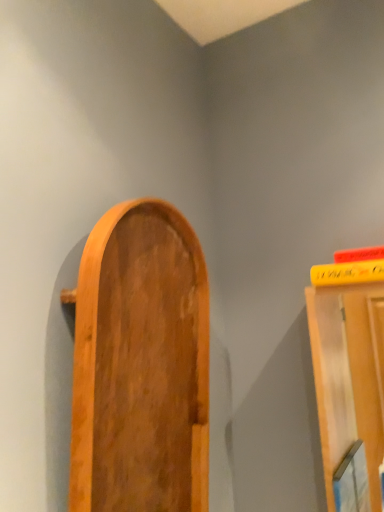
Question: Is wooden door at center wider than yellow matte book at upper right?

Choices:
 (A) no
 (B) yes

Answer: (A)

Question: Is wooden door at center outside yellow matte book at upper right?

Choices:
 (A) no
 (B) yes

Answer: (B)

Question: Does wooden door at center touch yellow matte book at upper right?

Choices:
 (A) yes
 (B) no

Answer: (B)

Question: From the image's perspective, is wooden door at center below yellow matte book at upper right?

Choices:
 (A) no
 (B) yes

Answer: (B)

Question: From a real-world perspective, is wooden door at center located higher than yellow matte book at upper right?

Choices:
 (A) yes
 (B) no

Answer: (B)

Question: Is wooden door at center aimed at yellow matte book at upper right?

Choices:
 (A) no
 (B) yes

Answer: (A)

Question: Is yellow matte book at upper right positioned far away from wooden door at center?

Choices:
 (A) yes
 (B) no

Answer: (B)

Question: Is wooden door at center inside yellow matte book at upper right?

Choices:
 (A) yes
 (B) no

Answer: (B)

Question: From a real-world perspective, is yellow matte book at upper right positioned over wooden door at center based on gravity?

Choices:
 (A) yes
 (B) no

Answer: (A)

Question: Can you confirm if yellow matte book at upper right is positioned to the left of wooden door at center?

Choices:
 (A) yes
 (B) no

Answer: (B)

Question: Is yellow matte book at upper right in front of wooden door at center?

Choices:
 (A) no
 (B) yes

Answer: (A)

Question: Is yellow matte book at upper right with wooden door at center?

Choices:
 (A) no
 (B) yes

Answer: (A)

Question: Considering the positions of point (329, 274) and point (205, 498), is point (329, 274) closer or farther from the camera than point (205, 498)?

Choices:
 (A) closer
 (B) farther

Answer: (A)